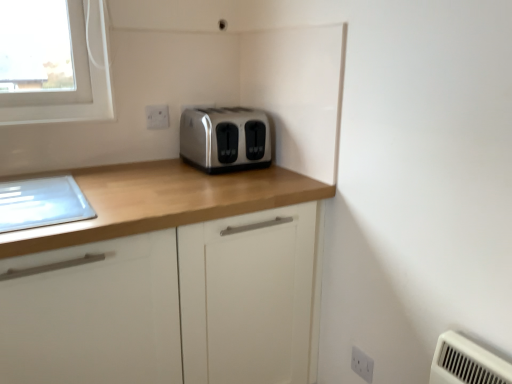
What are the coordinates of `satin silver toaster at center` in the screenshot? It's located at (225, 139).

What do you see at coordinates (167, 306) in the screenshot? I see `matte wood cabinet at center` at bounding box center [167, 306].

Measure the distance between point (74, 365) and camera.

Point (74, 365) and camera are 3.50 feet apart from each other.

Image resolution: width=512 pixels, height=384 pixels. What are the coordinates of `white plastic electric outlet at lower right, the 2th electric outlet in the back-to-front sequence` in the screenshot? It's located at (362, 364).

What is the approximate width of white plastic electric outlet at lower right, acting as the 1th electric outlet starting from the right?

white plastic electric outlet at lower right, acting as the 1th electric outlet starting from the right, is 1.29 inches wide.

Locate an element on the screen. This screenshot has width=512, height=384. satin silver toaster at center is located at coordinates (225, 139).

Who is smaller, satin silver toaster at center or white plastic electric outlet at lower right, which is counted as the 2th electric outlet, starting from the left?

With smaller size is white plastic electric outlet at lower right, which is counted as the 2th electric outlet, starting from the left.

Between satin silver toaster at center and white plastic electric outlet at lower right, which appears as the second electric outlet when viewed from the top, which one appears on the right side from the viewer's perspective?

From the viewer's perspective, white plastic electric outlet at lower right, which appears as the second electric outlet when viewed from the top, appears more on the right side.

From the image's perspective, would you say satin silver toaster at center is shown under white plastic electric outlet at lower right, positioned as the 1th electric outlet in bottom-to-top order?

No, from the image's perspective, satin silver toaster at center is not beneath white plastic electric outlet at lower right, positioned as the 1th electric outlet in bottom-to-top order.

Considering the positions of points (249, 268) and (366, 380), is point (249, 268) closer to camera compared to point (366, 380)?

Yes, it is.

Considering the sizes of objects matte wood cabinet at center and white plastic electric outlet at lower right, positioned as the 1th electric outlet in bottom-to-top order, in the image provided, who is bigger, matte wood cabinet at center or white plastic electric outlet at lower right, positioned as the 1th electric outlet in bottom-to-top order,?

matte wood cabinet at center is bigger.

From the image's perspective, which one is positioned higher, matte wood cabinet at center or white plastic electric outlet at lower right, positioned as the 1th electric outlet in bottom-to-top order?

From the image's view, matte wood cabinet at center is above.

Considering the sizes of matte wood cabinet at center and white plastic electric outlet at lower right, acting as the 1th electric outlet starting from the right, in the image, is matte wood cabinet at center wider or thinner than white plastic electric outlet at lower right, acting as the 1th electric outlet starting from the right,?

Considering their sizes, matte wood cabinet at center looks broader than white plastic electric outlet at lower right, acting as the 1th electric outlet starting from the right.

Between satin silver toaster at center and matte wood cabinet at center, which one appears on the right side from the viewer's perspective?

From the viewer's perspective, satin silver toaster at center appears more on the right side.

Does point (243, 147) come in front of point (5, 287)?

No, (243, 147) is further to viewer.

Relative to matte wood cabinet at center, is satin silver toaster at center in front or behind?

satin silver toaster at center is behind matte wood cabinet at center.

How many degrees apart are the facing directions of satin silver toaster at center and matte wood cabinet at center?

The angle between the facing direction of satin silver toaster at center and the facing direction of matte wood cabinet at center is 1.87 degrees.

Is white plastic electric outlet at upper center, which is the 2th electric outlet in bottom-to-top order, positioned with its back to white plastic electric outlet at lower right, acting as the 1th electric outlet starting from the right?

No, white plastic electric outlet at upper center, which is the 2th electric outlet in bottom-to-top order, is not facing away from white plastic electric outlet at lower right, acting as the 1th electric outlet starting from the right.

Would you say white plastic electric outlet at upper center, which is the second electric outlet from front to back, is a long distance from white plastic electric outlet at lower right, the 2th electric outlet in the back-to-front sequence?

white plastic electric outlet at upper center, which is the second electric outlet from front to back, is positioned a significant distance from white plastic electric outlet at lower right, the 2th electric outlet in the back-to-front sequence.

Would you say white plastic electric outlet at upper center, acting as the first electric outlet starting from the top, is to the left or to the right of white plastic electric outlet at lower right, positioned as the 1th electric outlet in bottom-to-top order, in the picture?

white plastic electric outlet at upper center, acting as the first electric outlet starting from the top, is to the left of white plastic electric outlet at lower right, positioned as the 1th electric outlet in bottom-to-top order.

I want to click on electric outlet above the white plastic electric outlet at lower right, positioned as the 1th electric outlet in bottom-to-top order (from a real-world perspective), so (157, 116).

Can you confirm if matte wood cabinet at center is positioned to the left of white plastic electric outlet at upper center, the 1th electric outlet when ordered from back to front?

Incorrect, matte wood cabinet at center is not on the left side of white plastic electric outlet at upper center, the 1th electric outlet when ordered from back to front.

Can you confirm if matte wood cabinet at center is smaller than white plastic electric outlet at upper center, the 1th electric outlet when ordered from back to front?

Actually, matte wood cabinet at center might be larger than white plastic electric outlet at upper center, the 1th electric outlet when ordered from back to front.

Is matte wood cabinet at center oriented towards white plastic electric outlet at upper center, which is the 2th electric outlet in bottom-to-top order?

No, matte wood cabinet at center does not turn towards white plastic electric outlet at upper center, which is the 2th electric outlet in bottom-to-top order.

Who is more distant, matte wood cabinet at center or white plastic electric outlet at upper center, acting as the first electric outlet starting from the top?

white plastic electric outlet at upper center, acting as the first electric outlet starting from the top, is behind.

Does white plastic electric outlet at upper center, acting as the first electric outlet starting from the top, have a larger size compared to matte wood cabinet at center?

Actually, white plastic electric outlet at upper center, acting as the first electric outlet starting from the top, might be smaller than matte wood cabinet at center.

From the image's perspective, is white plastic electric outlet at upper center, the 1th electric outlet when ordered from back to front, above matte wood cabinet at center?

Yes.

What's the angular difference between white plastic electric outlet at upper center, the 1th electric outlet when ordered from back to front, and matte wood cabinet at center's facing directions?

3.95 degrees separate the facing orientations of white plastic electric outlet at upper center, the 1th electric outlet when ordered from back to front, and matte wood cabinet at center.

Who is shorter, white plastic electric outlet at upper center, acting as the first electric outlet starting from the top, or matte wood cabinet at center?

white plastic electric outlet at upper center, acting as the first electric outlet starting from the top, is shorter.

From the image's perspective, which is below, white plastic electric outlet at lower right, positioned as the 1th electric outlet in bottom-to-top order, or matte wood cabinet at center?

From the image's view, white plastic electric outlet at lower right, positioned as the 1th electric outlet in bottom-to-top order, is below.

Where is `cabinetry above the white plastic electric outlet at lower right, the 2th electric outlet in the back-to-front sequence (from a real-world perspective)`? cabinetry above the white plastic electric outlet at lower right, the 2th electric outlet in the back-to-front sequence (from a real-world perspective) is located at coordinates (167, 306).

In the scene shown: Which is closer to the camera, (369, 372) or (90, 254)?

Positioned in front is point (90, 254).

What's the angular difference between white plastic electric outlet at lower right, positioned as the 1th electric outlet in bottom-to-top order, and matte wood cabinet at center's facing directions?

There is a 88.7-degree angle between the facing directions of white plastic electric outlet at lower right, positioned as the 1th electric outlet in bottom-to-top order, and matte wood cabinet at center.

What are the coordinates of `electric outlet on the right of satin silver toaster at center` in the screenshot? It's located at (362, 364).

You are a GUI agent. You are given a task and a screenshot of the screen. Output one action in this format:
    pyautogui.click(x=<x>, y=<y>)
    Task: Click on the cabinetry that is on the left side of white plastic electric outlet at lower right, acting as the 1th electric outlet starting from the right
    
    Given the screenshot: What is the action you would take?
    pyautogui.click(x=167, y=306)

From the image, which object appears to be nearer to white plastic electric outlet at upper center, which is the 2th electric outlet in bottom-to-top order, matte wood cabinet at center or satin silver toaster at center?

satin silver toaster at center is positioned closer to the anchor white plastic electric outlet at upper center, which is the 2th electric outlet in bottom-to-top order.

Looking at the image, which one is located further to satin silver toaster at center, matte wood cabinet at center or white plastic electric outlet at upper center, which is counted as the 2th electric outlet, starting from the right?

Based on the image, matte wood cabinet at center appears to be further to satin silver toaster at center.

Considering their positions, is white plastic electric outlet at upper center, acting as the first electric outlet starting from the top, positioned further to white plastic electric outlet at lower right, which is counted as the 2th electric outlet, starting from the left, than satin silver toaster at center?

white plastic electric outlet at upper center, acting as the first electric outlet starting from the top, is further to white plastic electric outlet at lower right, which is counted as the 2th electric outlet, starting from the left.

Estimate the real-world distances between objects in this image. Which object is further from white plastic electric outlet at lower right, which appears as the second electric outlet when viewed from the top, satin silver toaster at center or white plastic electric outlet at upper center, which is the second electric outlet from front to back?

Among the two, white plastic electric outlet at upper center, which is the second electric outlet from front to back, is located further to white plastic electric outlet at lower right, which appears as the second electric outlet when viewed from the top.

Looking at this image, when comparing their distances from white plastic electric outlet at upper center, which is counted as the 2th electric outlet, starting from the right, does satin silver toaster at center or white plastic electric outlet at lower right, positioned as the 1th electric outlet in bottom-to-top order, seem closer?

satin silver toaster at center.

When comparing their distances from satin silver toaster at center, does white plastic electric outlet at upper center, the 1th electric outlet when ordered from back to front, or matte wood cabinet at center seem closer?

white plastic electric outlet at upper center, the 1th electric outlet when ordered from back to front, lies closer to satin silver toaster at center than the other object.

When comparing their distances from matte wood cabinet at center, does white plastic electric outlet at upper center, which is the 2th electric outlet in bottom-to-top order, or white plastic electric outlet at lower right, which appears as the second electric outlet when viewed from the top, seem further?

white plastic electric outlet at upper center, which is the 2th electric outlet in bottom-to-top order, is positioned further to the anchor matte wood cabinet at center.

Looking at the image, which one is located closer to white plastic electric outlet at upper center, which is counted as the 2th electric outlet, starting from the right, satin silver toaster at center or matte wood cabinet at center?

Among the two, satin silver toaster at center is located nearer to white plastic electric outlet at upper center, which is counted as the 2th electric outlet, starting from the right.

This screenshot has width=512, height=384. I want to click on cabinetry that lies between white plastic electric outlet at upper center, acting as the first electric outlet starting from the top, and white plastic electric outlet at lower right, which is counted as the 2th electric outlet, starting from the left, from top to bottom, so click(167, 306).

Where is `toaster located between matte wood cabinet at center and white plastic electric outlet at upper center, which is counted as the 2th electric outlet, starting from the right, in the depth direction`? Image resolution: width=512 pixels, height=384 pixels. toaster located between matte wood cabinet at center and white plastic electric outlet at upper center, which is counted as the 2th electric outlet, starting from the right, in the depth direction is located at coordinates (225, 139).

Where is `toaster between white plastic electric outlet at upper center, acting as the first electric outlet starting from the top, and white plastic electric outlet at lower right, the 2th electric outlet in the back-to-front sequence, from top to bottom`? This screenshot has width=512, height=384. toaster between white plastic electric outlet at upper center, acting as the first electric outlet starting from the top, and white plastic electric outlet at lower right, the 2th electric outlet in the back-to-front sequence, from top to bottom is located at coordinates (225, 139).

Identify the location of cabinetry between satin silver toaster at center and white plastic electric outlet at lower right, positioned as the 1th electric outlet in bottom-to-top order, in the vertical direction. (167, 306).